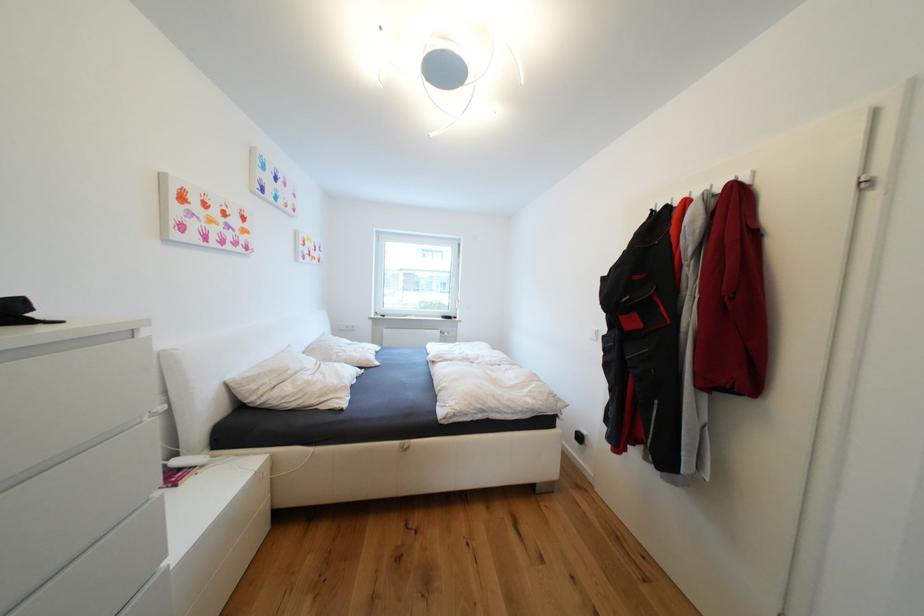
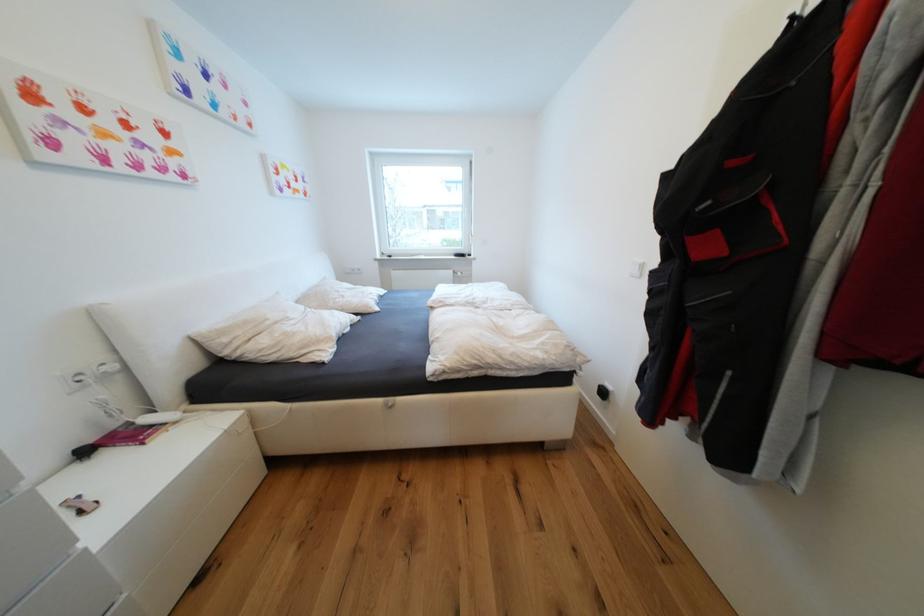
Locate, in the second image, the point that corresponds to (x=188, y=471) in the first image.

(159, 428)